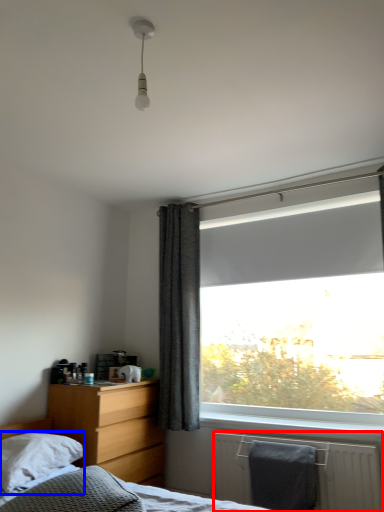
Question: Which point is further to the camera, radiator (highlighted by a red box) or pillow (highlighted by a blue box)?

Choices:
 (A) radiator
 (B) pillow

Answer: (A)